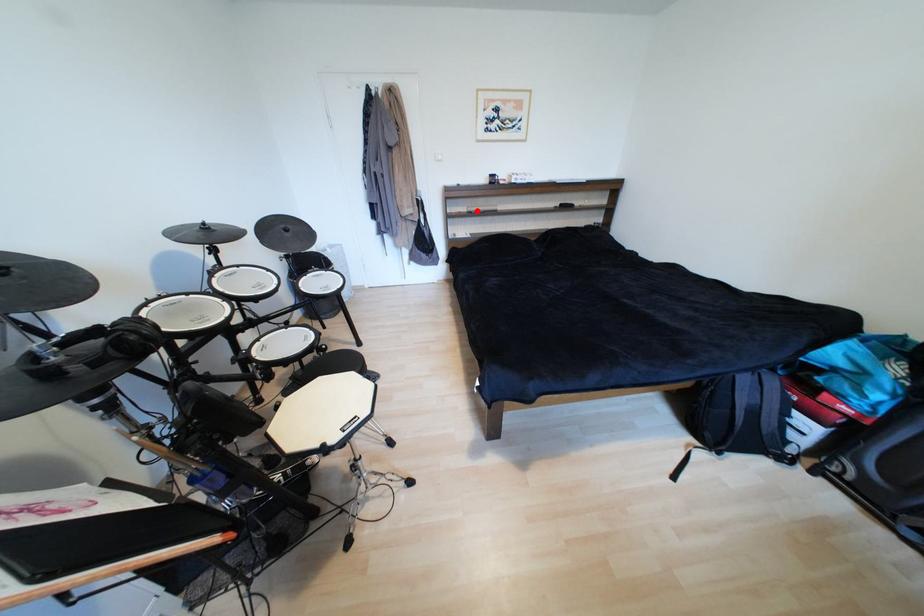
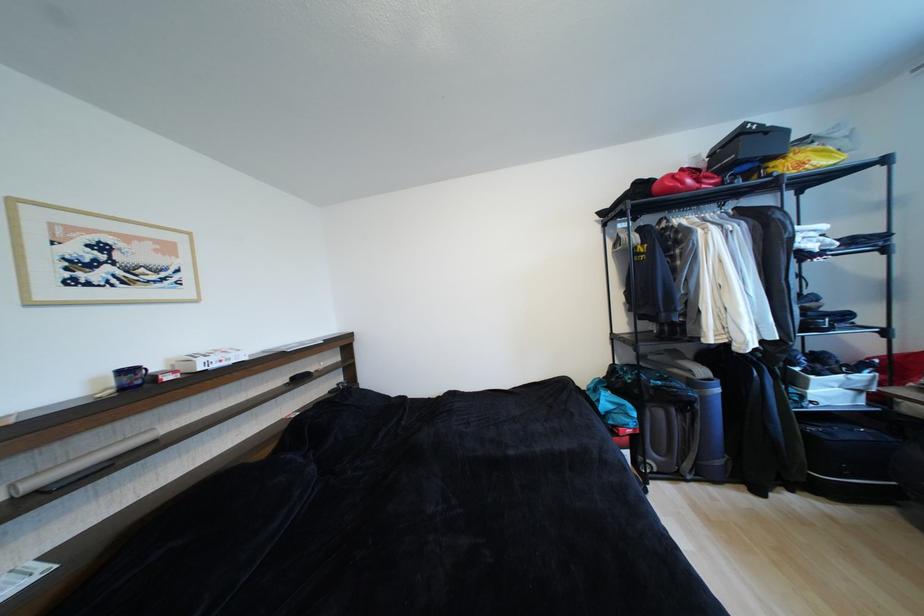
Find the pixel in the second image that matches the highlighted location in the first image.

(40, 485)